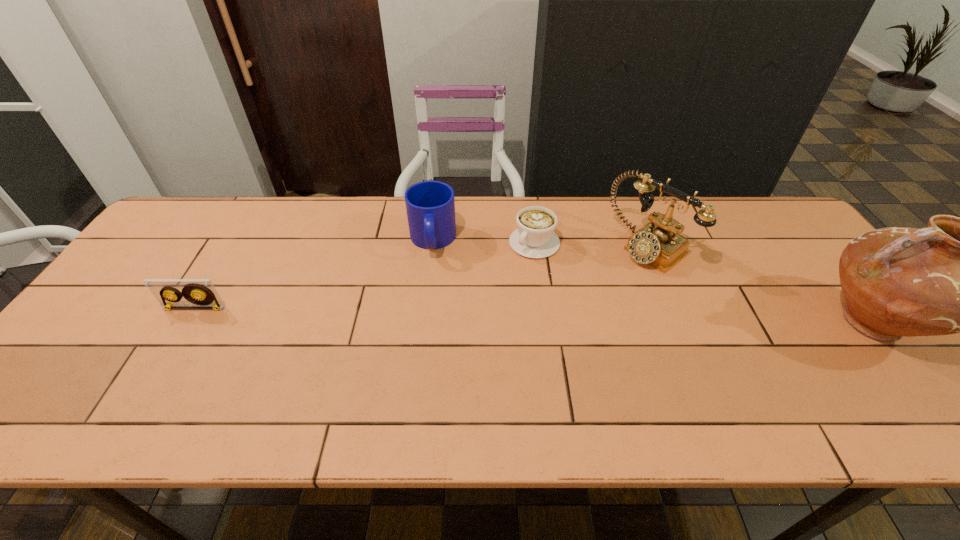
In the image, there is a desktop. At what (x,y) coordinates should I click in order to perform the action: click on vacant space at the far edge. Please return your answer as a coordinate pair (x, y). The image size is (960, 540). Looking at the image, I should click on (472, 225).

In the image, there is a desktop. Identify the location of free space at the near edge. (284, 378).

This screenshot has width=960, height=540. I want to click on vacant area at the left edge of the desktop, so click(x=102, y=312).

Image resolution: width=960 pixels, height=540 pixels. Identify the location of vacant space at the right edge. (824, 285).

Locate an element on the screen. free space at the far right corner is located at coordinates (734, 214).

Identify the location of vacant space in between the fourth object from right to left and the leftmost object. (313, 274).

In order to click on unoccupied area between the fourth object from right to left and the leftmost object in this screenshot , I will do `click(313, 274)`.

Identify the location of free spot between the videotape and the cappuccino. Image resolution: width=960 pixels, height=540 pixels. (365, 276).

Image resolution: width=960 pixels, height=540 pixels. What are the coordinates of `blank region between the third object from right to left and the fourth object from left to right` in the screenshot? It's located at (590, 244).

Choose which object is the nearest neighbor to the cappuccino. Please provide its 2D coordinates. Your answer should be formatted as a tuple, i.e. [(x, y)], where the tuple contains the x and y coordinates of a point satisfying the conditions above.

[(658, 243)]